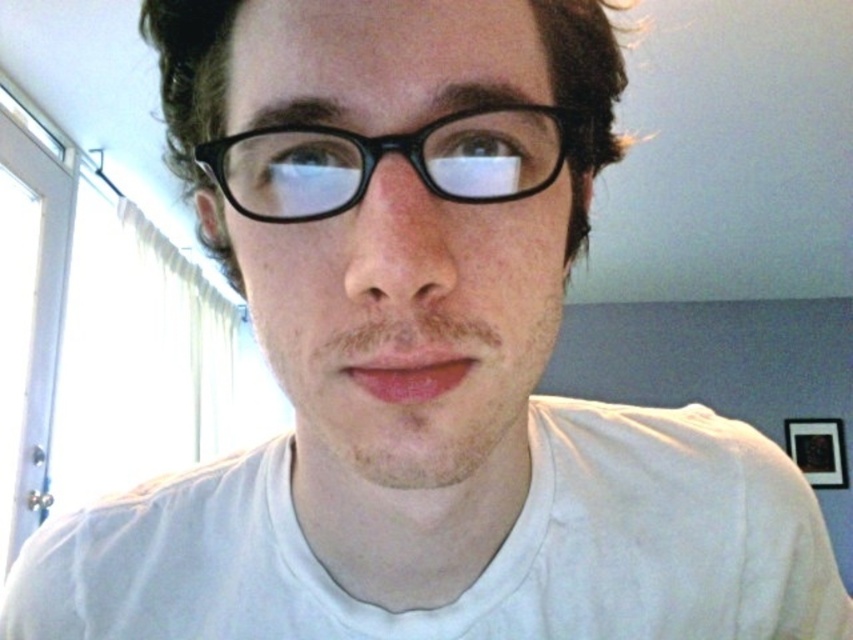
Question: Which of the following is the closest to the observer?

Choices:
 (A) (502, 177)
 (B) (741, 525)

Answer: (A)

Question: Which of the following is the closest to the observer?

Choices:
 (A) white cotton t-shirt at center
 (B) black plastic glasses at center

Answer: (B)

Question: Considering the relative positions of white cotton t-shirt at center and black plastic glasses at center in the image provided, where is white cotton t-shirt at center located with respect to black plastic glasses at center?

Choices:
 (A) above
 (B) below

Answer: (B)

Question: Does white cotton t-shirt at center have a larger size compared to black plastic glasses at center?

Choices:
 (A) no
 (B) yes

Answer: (B)

Question: Does white cotton t-shirt at center appear over black plastic glasses at center?

Choices:
 (A) no
 (B) yes

Answer: (A)